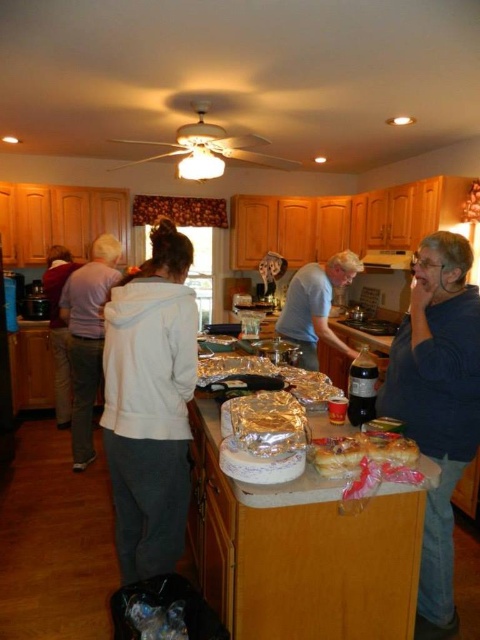
Between blue cotton shirt at right and light gray hoodie at center, which one has more height?

light gray hoodie at center is taller.

Is blue cotton shirt at right above light gray hoodie at center?

Actually, blue cotton shirt at right is below light gray hoodie at center.

Does point (443, 524) come behind point (71, 256)?

No, (443, 524) is closer to viewer.

Where is `blue cotton shirt at right`? This screenshot has width=480, height=640. blue cotton shirt at right is located at coordinates (437, 404).

The width and height of the screenshot is (480, 640). What do you see at coordinates (149, 404) in the screenshot?
I see `white matte hoodie at center` at bounding box center [149, 404].

Who is shorter, white matte hoodie at center or light blue t-shirt at center?

light blue t-shirt at center is shorter.

Who is more distant from viewer, (432,512) or (324,289)?

The point (324,289) is behind.

Identify the location of white matte hoodie at center. (149, 404).

Can you confirm if white fleece jacket at center is bigger than golden flaky pie at center?

Yes, white fleece jacket at center is bigger than golden flaky pie at center.

Is white fleece jacket at center to the right of golden flaky pie at center from the viewer's perspective?

In fact, white fleece jacket at center is to the left of golden flaky pie at center.

This screenshot has width=480, height=640. Identify the location of white fleece jacket at center. (149, 404).